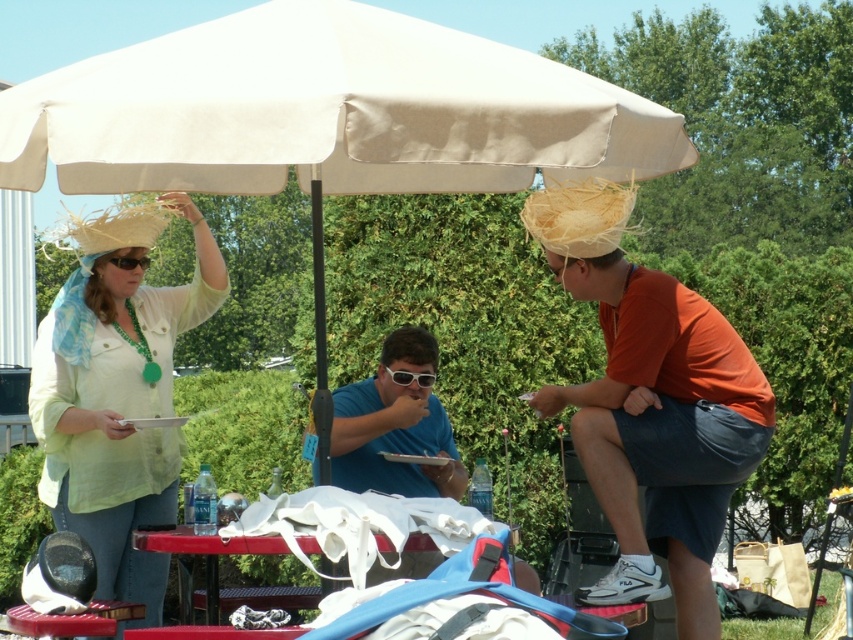
Question: Which object is farther from the camera taking this photo?

Choices:
 (A) blue matte shirt at center
 (B) light beige straw hat at upper left
 (C) beige fabric umbrella at center

Answer: (B)

Question: Considering the relative positions of blue matte shirt at center and matte blue shirt at center in the image provided, where is blue matte shirt at center located with respect to matte blue shirt at center?

Choices:
 (A) right
 (B) left

Answer: (A)

Question: Does blue matte shirt at center appear on the left side of white fabric table at center?

Choices:
 (A) no
 (B) yes

Answer: (A)

Question: Can you confirm if orange cotton shirt at right is thinner than light beige straw hat at upper left?

Choices:
 (A) yes
 (B) no

Answer: (A)

Question: Which of the following is the closest to the observer?

Choices:
 (A) matte yellow goggles at upper left
 (B) orange cotton shirt at right
 (C) matte straw hat at left
 (D) light beige straw hat at upper left

Answer: (C)

Question: Estimate the real-world distances between objects in this image. Which object is farther from the beige fabric umbrella at center?

Choices:
 (A) light beige straw hat at upper left
 (B) orange cotton shirt at right
 (C) white fabric table at center
 (D) matte yellow goggles at upper left

Answer: (A)